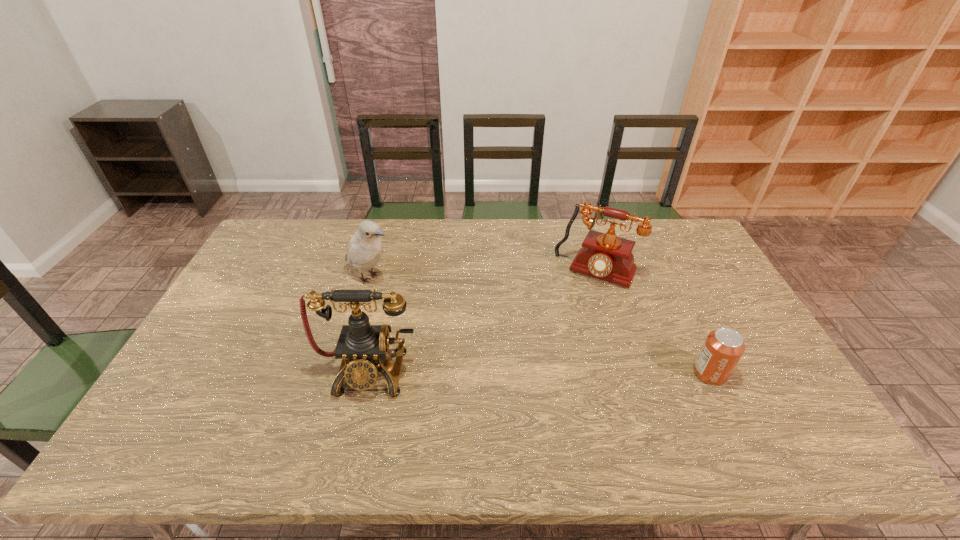
This screenshot has height=540, width=960. What are the coordinates of `free space that satisfies the following two spatial constraints: 1. on the front side of the right telephone; 2. on the left side of the can` in the screenshot? It's located at (628, 374).